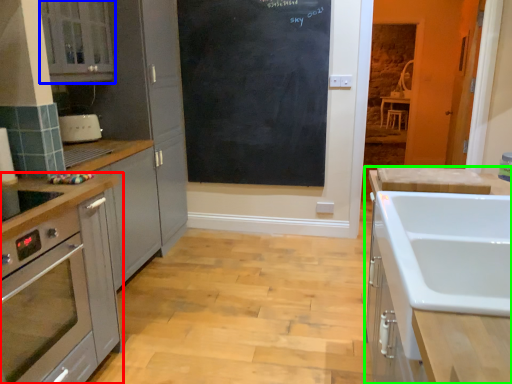
Question: Based on their relative distances, which object is nearer to cabinetry (highlighted by a red box)? Choose from cabinetry (highlighted by a blue box) and cabinetry (highlighted by a green box).

Choices:
 (A) cabinetry
 (B) cabinetry

Answer: (A)